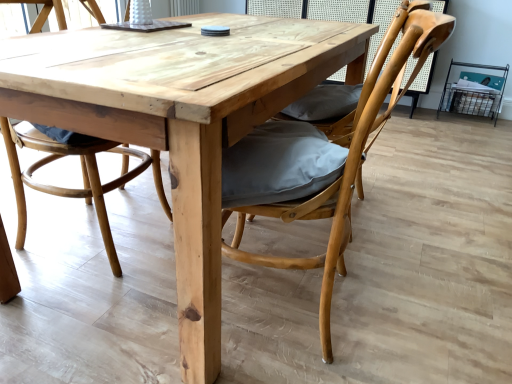
This screenshot has width=512, height=384. Describe the element at coordinates (349, 155) in the screenshot. I see `natural wood chair at center, which appears as the first chair when viewed from the right` at that location.

This screenshot has width=512, height=384. Identify the location of natural wood chair at center, the 2th chair viewed from the right. (82, 174).

Where is `natural wood table at center`? This screenshot has height=384, width=512. natural wood table at center is located at coordinates (177, 125).

Does point (402, 65) lie behind point (352, 51)?

Yes, point (402, 65) is farther from viewer.

Does natural wood chair at center, which appears as the first chair when viewed from the right, have a larger size compared to natural wood table at center?

Incorrect, natural wood chair at center, which appears as the first chair when viewed from the right, is not larger than natural wood table at center.

Is natural wood chair at center, which is counted as the second chair, starting from the left, next to natural wood table at center?

natural wood chair at center, which is counted as the second chair, starting from the left, and natural wood table at center are not in contact.

In the scene shown: Who is taller, natural wood chair at center, which is counted as the second chair, starting from the left, or natural wood table at center?

→ With more height is natural wood chair at center, which is counted as the second chair, starting from the left.

Is natural wood table at center a part of natural wood chair at center, the first chair when ordered from left to right?

Actually, natural wood table at center is outside natural wood chair at center, the first chair when ordered from left to right.

Which of these two, natural wood chair at center, the 2th chair viewed from the right, or natural wood table at center, is smaller?

natural wood chair at center, the 2th chair viewed from the right.

Which object is positioned more to the left, natural wood chair at center, the first chair when ordered from left to right, or natural wood table at center?

Positioned to the left is natural wood chair at center, the first chair when ordered from left to right.

Could you tell me if natural wood chair at center, the first chair when ordered from left to right, is turned towards natural wood table at center?

Yes, natural wood chair at center, the first chair when ordered from left to right, is aimed at natural wood table at center.

Considering the positions of objects natural wood table at center and natural wood chair at center, which appears as the first chair when viewed from the right, in the image provided, who is more to the left, natural wood table at center or natural wood chair at center, which appears as the first chair when viewed from the right,?

Positioned to the left is natural wood table at center.

Is natural wood table at center bigger or smaller than natural wood chair at center, which appears as the first chair when viewed from the right?

natural wood table at center is bigger than natural wood chair at center, which appears as the first chair when viewed from the right.

Is natural wood table at center turned away from natural wood chair at center, which is counted as the second chair, starting from the left?

Yes, natural wood chair at center, which is counted as the second chair, starting from the left, is at the back of natural wood table at center.

How much distance is there between natural wood table at center and natural wood chair at center, which appears as the first chair when viewed from the right?

They are 12.66 inches apart.

Is natural wood table at center shorter than natural wood chair at center, the 2th chair viewed from the right?

Correct, natural wood table at center is not as tall as natural wood chair at center, the 2th chair viewed from the right.

Considering the positions of objects natural wood table at center and natural wood chair at center, the first chair when ordered from left to right, in the image provided, who is more to the left, natural wood table at center or natural wood chair at center, the first chair when ordered from left to right,?

From the viewer's perspective, natural wood chair at center, the first chair when ordered from left to right, appears more on the left side.

Is there a large distance between natural wood table at center and natural wood chair at center, the 2th chair viewed from the right?

They are positioned close to each other.

The height and width of the screenshot is (384, 512). Find the location of `chair behind the natural wood table at center`. chair behind the natural wood table at center is located at coordinates (82, 174).

Between point (403, 25) and point (151, 161), which one is positioned behind?

Positioned behind is point (151, 161).

From a real-world perspective, is natural wood chair at center, which appears as the first chair when viewed from the right, located higher than natural wood chair at center, the 2th chair viewed from the right?

Yes, from a real-world perspective, natural wood chair at center, which appears as the first chair when viewed from the right, is on top of natural wood chair at center, the 2th chair viewed from the right.

Visually, is natural wood chair at center, which is counted as the second chair, starting from the left, positioned to the left or to the right of natural wood chair at center, the first chair when ordered from left to right?

From the image, it's evident that natural wood chair at center, which is counted as the second chair, starting from the left, is to the right of natural wood chair at center, the first chair when ordered from left to right.

Is natural wood chair at center, the first chair when ordered from left to right, oriented towards natural wood chair at center, which is counted as the second chair, starting from the left?

Yes, natural wood chair at center, the first chair when ordered from left to right, is oriented towards natural wood chair at center, which is counted as the second chair, starting from the left.

Does natural wood chair at center, the first chair when ordered from left to right, appear on the left side of natural wood chair at center, which appears as the first chair when viewed from the right?

Yes.

Is natural wood chair at center, the 2th chair viewed from the right, not close to natural wood chair at center, which is counted as the second chair, starting from the left?

No.

From a real-world perspective, is natural wood chair at center, the 2th chair viewed from the right, positioned under natural wood chair at center, which is counted as the second chair, starting from the left, based on gravity?

Yes, from a real-world perspective, natural wood chair at center, the 2th chair viewed from the right, is beneath natural wood chair at center, which is counted as the second chair, starting from the left.

Find the location of `kitchen & dining room table above the natural wood chair at center, which appears as the first chair when viewed from the right (from the image's perspective)`. kitchen & dining room table above the natural wood chair at center, which appears as the first chair when viewed from the right (from the image's perspective) is located at coordinates (177, 125).

Locate an element on the screen. chair that is the 1st one above the natural wood table at center (from a real-world perspective) is located at coordinates (82, 174).

Considering their positions, is natural wood table at center positioned further to natural wood chair at center, the 2th chair viewed from the right, than natural wood chair at center, which appears as the first chair when viewed from the right?

natural wood chair at center, which appears as the first chair when viewed from the right, is positioned further to the anchor natural wood chair at center, the 2th chair viewed from the right.

Estimate the real-world distances between objects in this image. Which object is further from natural wood table at center, natural wood chair at center, the 2th chair viewed from the right, or natural wood chair at center, which appears as the first chair when viewed from the right?

natural wood chair at center, the 2th chair viewed from the right, lies further to natural wood table at center than the other object.

From the image, which object appears to be farther from natural wood chair at center, which appears as the first chair when viewed from the right, natural wood chair at center, the first chair when ordered from left to right, or natural wood table at center?

natural wood chair at center, the first chair when ordered from left to right, lies further to natural wood chair at center, which appears as the first chair when viewed from the right, than the other object.

Considering their positions, is natural wood chair at center, which appears as the first chair when viewed from the right, positioned further to natural wood chair at center, the 2th chair viewed from the right, than natural wood table at center?

natural wood chair at center, which appears as the first chair when viewed from the right, is further to natural wood chair at center, the 2th chair viewed from the right.

Estimate the real-world distances between objects in this image. Which object is closer to natural wood chair at center, which appears as the first chair when viewed from the right, natural wood table at center or natural wood chair at center, the first chair when ordered from left to right?

natural wood table at center is positioned closer to the anchor natural wood chair at center, which appears as the first chair when viewed from the right.

Looking at the image, which one is located further to natural wood table at center, natural wood chair at center, which is counted as the second chair, starting from the left, or natural wood chair at center, the 2th chair viewed from the right?

natural wood chair at center, the 2th chair viewed from the right.

Where is `kitchen & dining room table between natural wood chair at center, the first chair when ordered from left to right, and natural wood chair at center, which appears as the first chair when viewed from the right, from left to right`? kitchen & dining room table between natural wood chair at center, the first chair when ordered from left to right, and natural wood chair at center, which appears as the first chair when viewed from the right, from left to right is located at coordinates (177, 125).